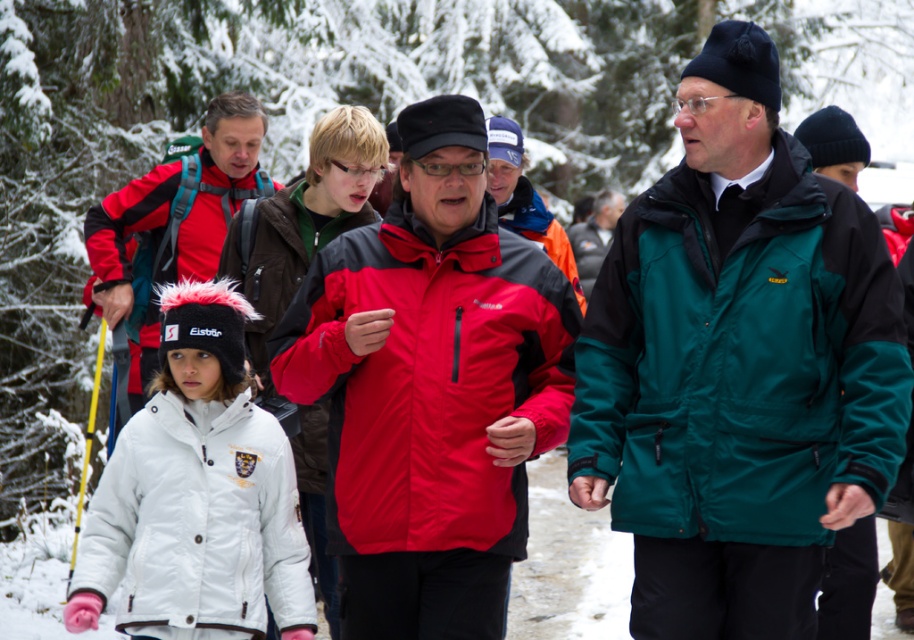
You are navigating a snowy forest and need to locate the white fleece jacket at center. According to the coordinates provided, where would you find it?

The white fleece jacket at center is located at coordinates point (303, 221).